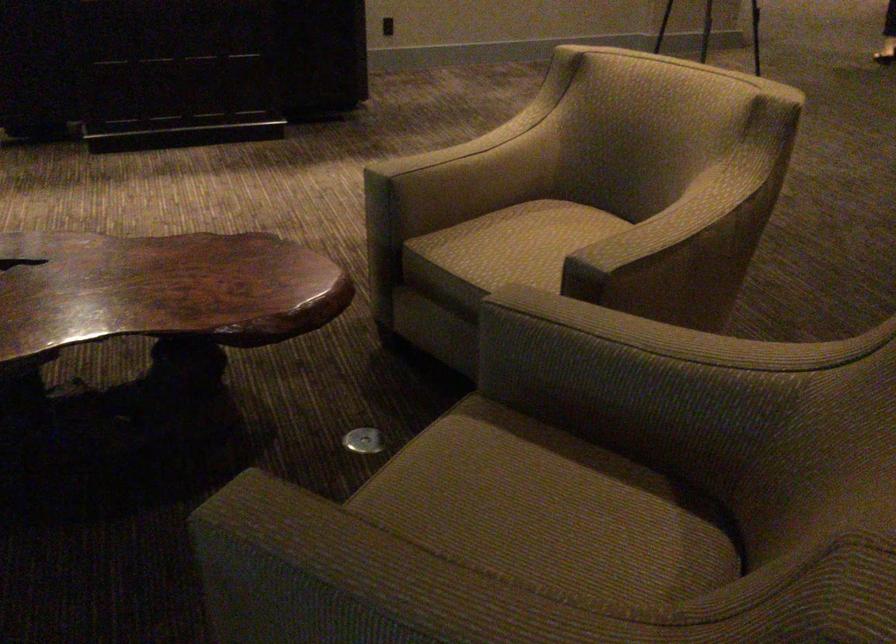
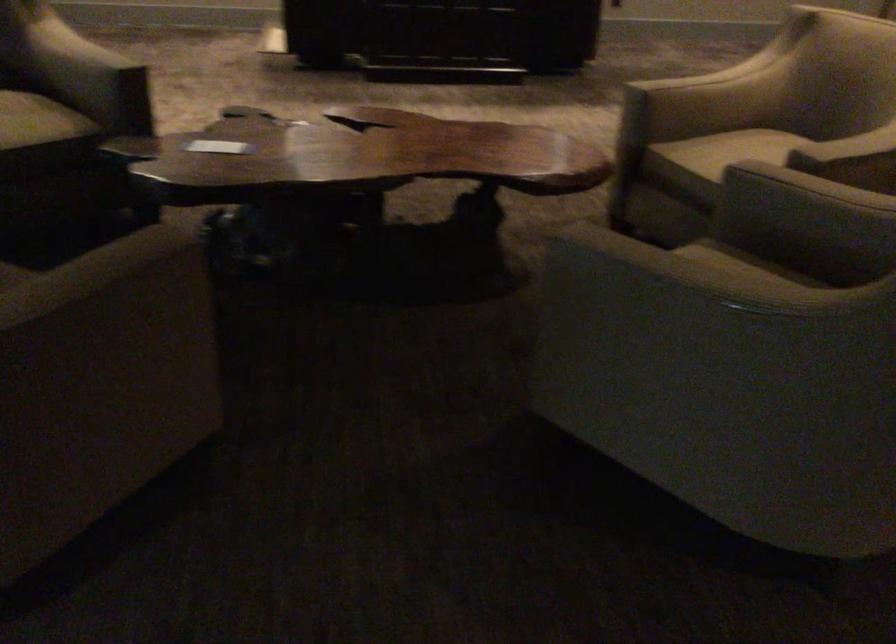
Question: I am providing you with two images of the same scene from different viewpoints. Please identify which objects are invisible in image2.

Choices:
 (A) small tissue box
 (B) chair armrest
 (C) chair sitting surface
 (D) white rectangular label

Answer: (C)